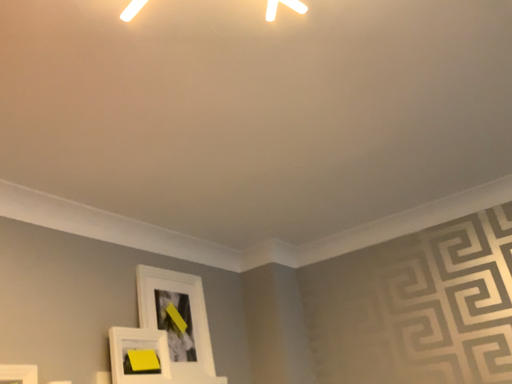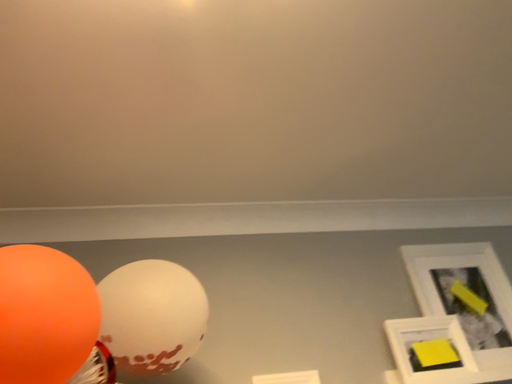
Question: How did the camera likely rotate when shooting the video?

Choices:
 (A) rotated downward
 (B) rotated upward

Answer: (A)